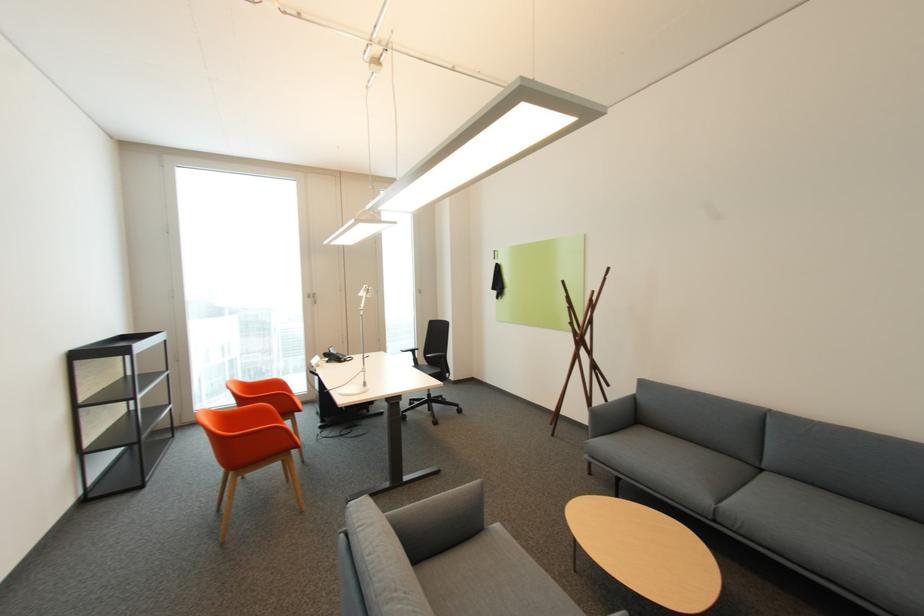
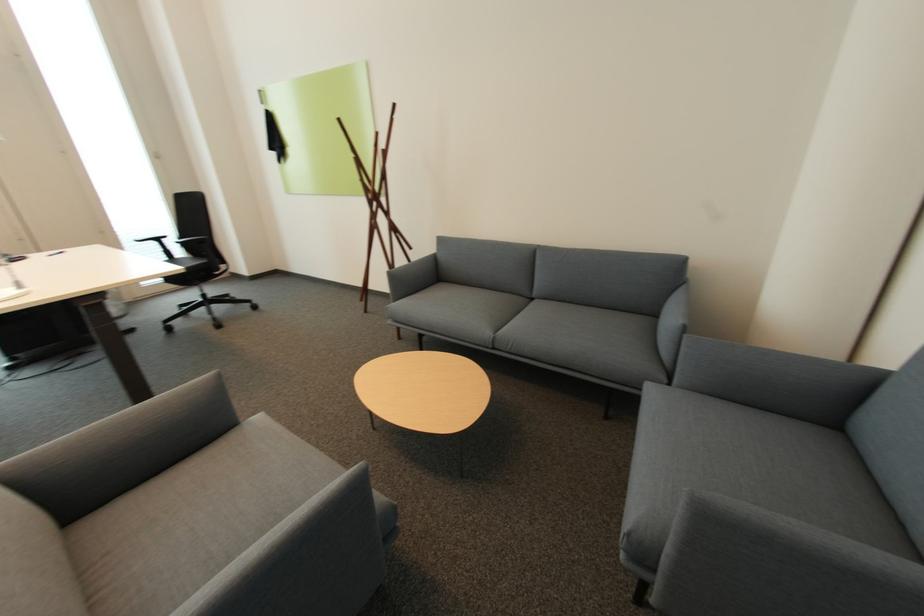
The first image is from the beginning of the video and the second image is from the end. How did the camera likely rotate when shooting the video?

The rotation direction of the camera is right-down.